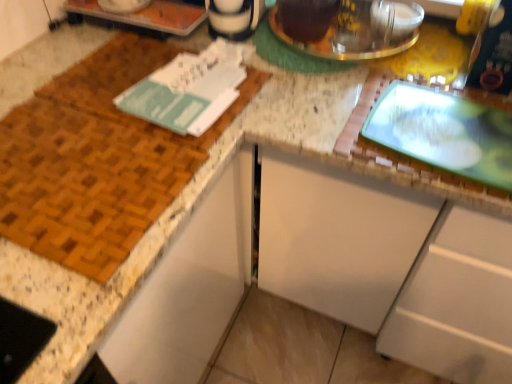
Question: Can you confirm if teal paper journal at upper left is bigger than shiny metallic kettle at upper center?

Choices:
 (A) no
 (B) yes

Answer: (A)

Question: Does teal paper journal at upper left appear on the right side of shiny metallic kettle at upper center?

Choices:
 (A) no
 (B) yes

Answer: (A)

Question: Does teal paper journal at upper left have a greater width compared to shiny metallic kettle at upper center?

Choices:
 (A) no
 (B) yes

Answer: (A)

Question: Is the position of teal paper journal at upper left more distant than that of shiny metallic kettle at upper center?

Choices:
 (A) yes
 (B) no

Answer: (B)

Question: Is teal paper journal at upper left next to shiny metallic kettle at upper center?

Choices:
 (A) yes
 (B) no

Answer: (B)

Question: From their relative heights in the image, would you say white matte cabinet at center is taller or shorter than shiny metallic kettle at upper center?

Choices:
 (A) tall
 (B) short

Answer: (A)

Question: Based on their sizes in the image, would you say white matte cabinet at center is bigger or smaller than shiny metallic kettle at upper center?

Choices:
 (A) small
 (B) big

Answer: (B)

Question: From the image's perspective, is white matte cabinet at center located above or below shiny metallic kettle at upper center?

Choices:
 (A) above
 (B) below

Answer: (B)

Question: Which is correct: white matte cabinet at center is inside shiny metallic kettle at upper center, or outside of it?

Choices:
 (A) inside
 (B) outside

Answer: (B)

Question: From the image's perspective, relative to white matte cabinet at center, is shiny metallic kettle at upper center above or below?

Choices:
 (A) below
 (B) above

Answer: (B)

Question: Is point (297, 44) positioned closer to the camera than point (407, 337)?

Choices:
 (A) closer
 (B) farther

Answer: (A)

Question: Is shiny metallic kettle at upper center to the left or to the right of white matte cabinet at center in the image?

Choices:
 (A) left
 (B) right

Answer: (A)

Question: Considering the positions of shiny metallic kettle at upper center and white matte cabinet at center in the image, is shiny metallic kettle at upper center bigger or smaller than white matte cabinet at center?

Choices:
 (A) big
 (B) small

Answer: (B)

Question: In terms of height, does teal paper journal at upper left look taller or shorter compared to white matte cabinet at center?

Choices:
 (A) tall
 (B) short

Answer: (B)

Question: From a real-world perspective, is teal paper journal at upper left positioned above or below white matte cabinet at center?

Choices:
 (A) below
 (B) above

Answer: (B)